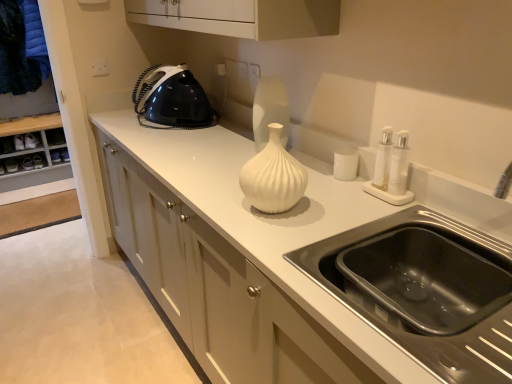
The width and height of the screenshot is (512, 384). Find the location of `free space in front of white matte vase at center`. free space in front of white matte vase at center is located at coordinates (278, 238).